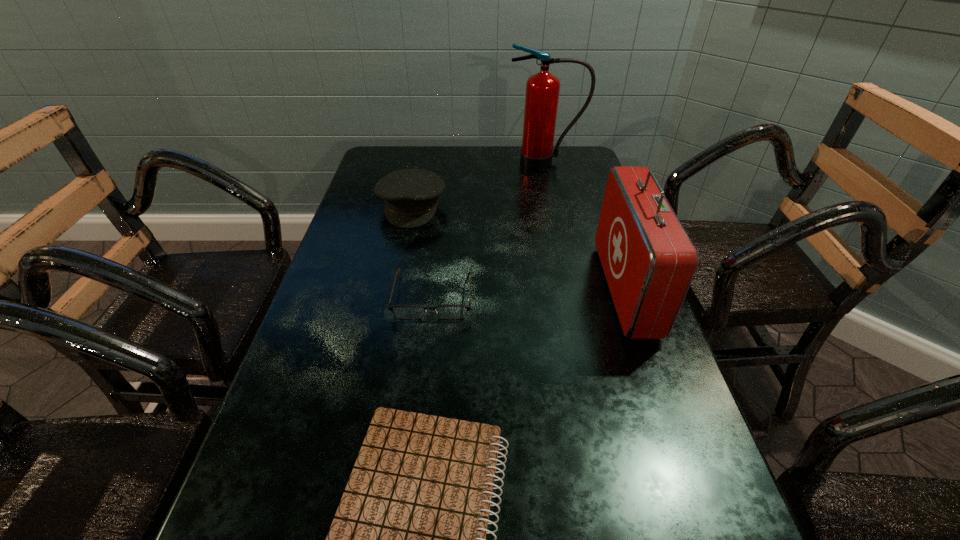
Identify which object is the second nearest to the fire extinguisher. Please provide its 2D coordinates. Your answer should be formatted as a tuple, i.e. [(x, y)], where the tuple contains the x and y coordinates of a point satisfying the conditions above.

[(649, 261)]

At what (x,y) coordinates should I click in order to perform the action: click on object that is the third closest to the second tallest object. Please return your answer as a coordinate pair (x, y). The image size is (960, 540). Looking at the image, I should click on (411, 196).